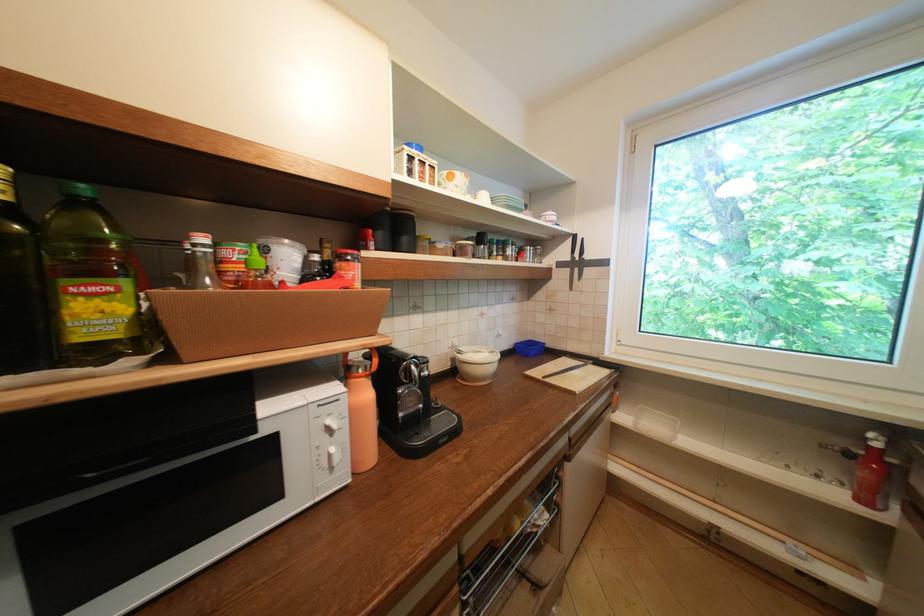
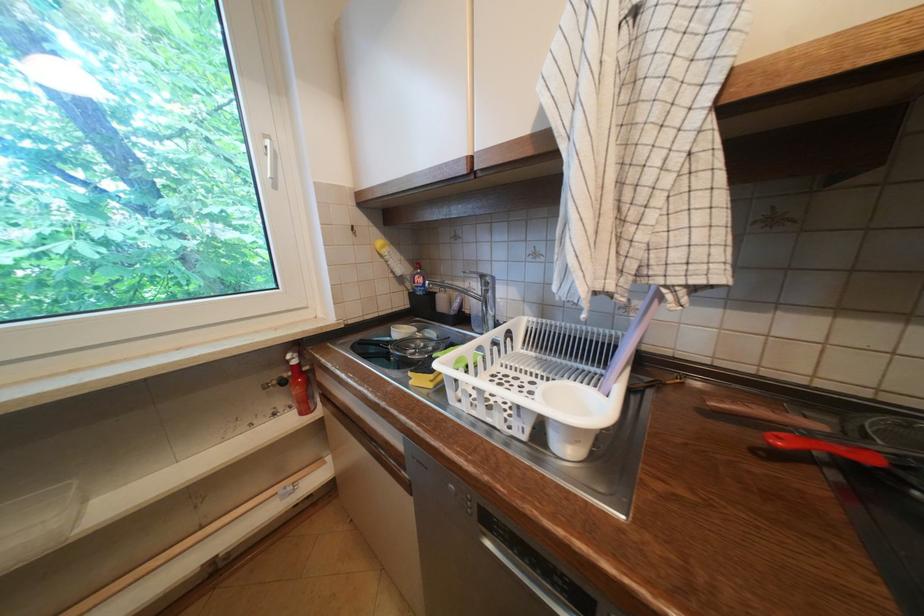
Question: The first image is from the beginning of the video and the second image is from the end. How did the camera likely rotate when shooting the video?

Choices:
 (A) Left
 (B) Right
 (C) Up
 (D) Down

Answer: (B)